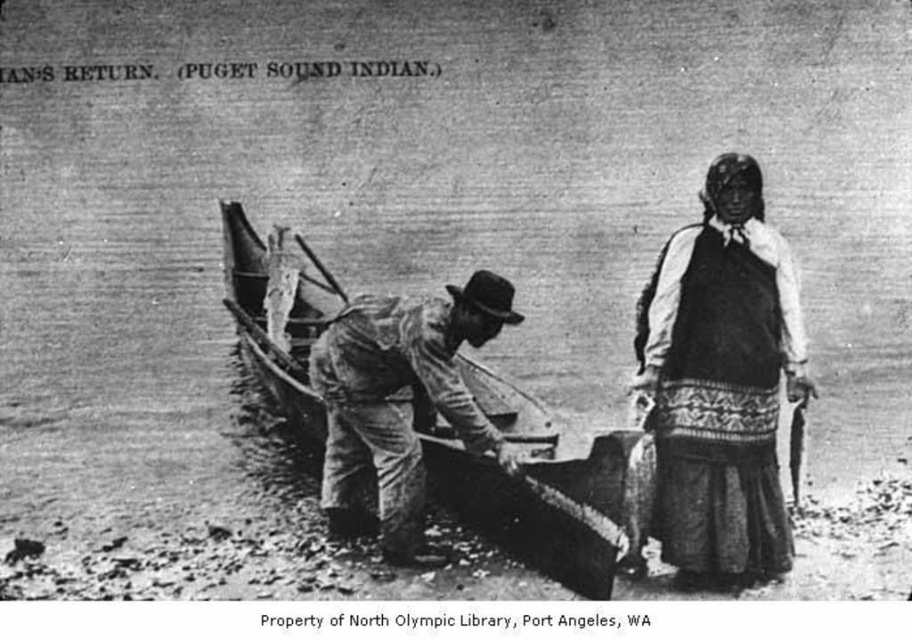
Question: Among these points, which one is nearest to the camera?

Choices:
 (A) (741, 292)
 (B) (515, 433)
 (C) (430, 348)

Answer: (A)

Question: From the image, what is the correct spatial relationship of wooden canoe at center in relation to rough wooden oar at center?

Choices:
 (A) below
 (B) above

Answer: (B)

Question: Can you confirm if patterned fabric dress at center is bigger than wooden canoe at center?

Choices:
 (A) no
 (B) yes

Answer: (A)

Question: Does patterned fabric dress at center appear on the left side of wooden canoe at center?

Choices:
 (A) no
 (B) yes

Answer: (A)

Question: Which object is farther from the camera taking this photo?

Choices:
 (A) wooden canoe at center
 (B) rough wooden oar at center
 (C) patterned fabric dress at center

Answer: (C)

Question: Among these objects, which one is nearest to the camera?

Choices:
 (A) patterned fabric dress at center
 (B) wooden canoe at center

Answer: (B)